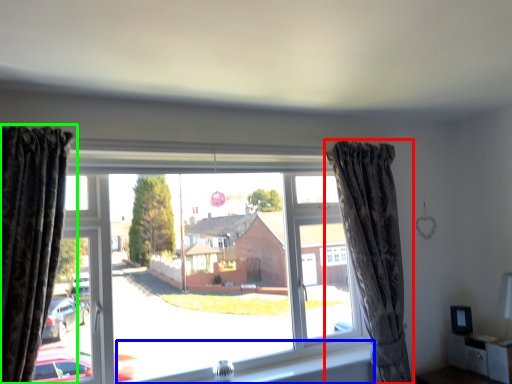
Question: Which object is positioned closest to curtain (highlighted by a red box)? Select from window sill (highlighted by a blue box) and curtain (highlighted by a green box).

Choices:
 (A) window sill
 (B) curtain

Answer: (A)